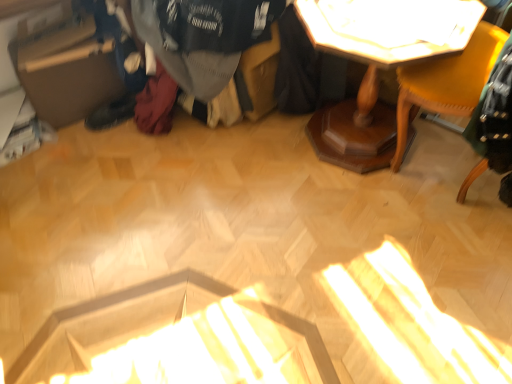
Question: From a real-world perspective, is matte yellow chair at upper right physically located above or below wooden table at upper right?

Choices:
 (A) below
 (B) above

Answer: (B)

Question: Visually, is matte yellow chair at upper right positioned to the left or to the right of wooden table at upper right?

Choices:
 (A) right
 (B) left

Answer: (A)

Question: Estimate the real-world distances between objects in this image. Which object is closer to the white glossy table at upper center?

Choices:
 (A) matte yellow chair at upper right
 (B) wooden table at upper right
 (C) dark gray sweater at center
 (D) brown cardboard box at left

Answer: (B)

Question: Considering the real-world distances, which object is farthest from the white glossy table at upper center?

Choices:
 (A) brown cardboard box at left
 (B) wooden table at upper right
 (C) dark gray sweater at center
 (D) matte yellow chair at upper right

Answer: (A)